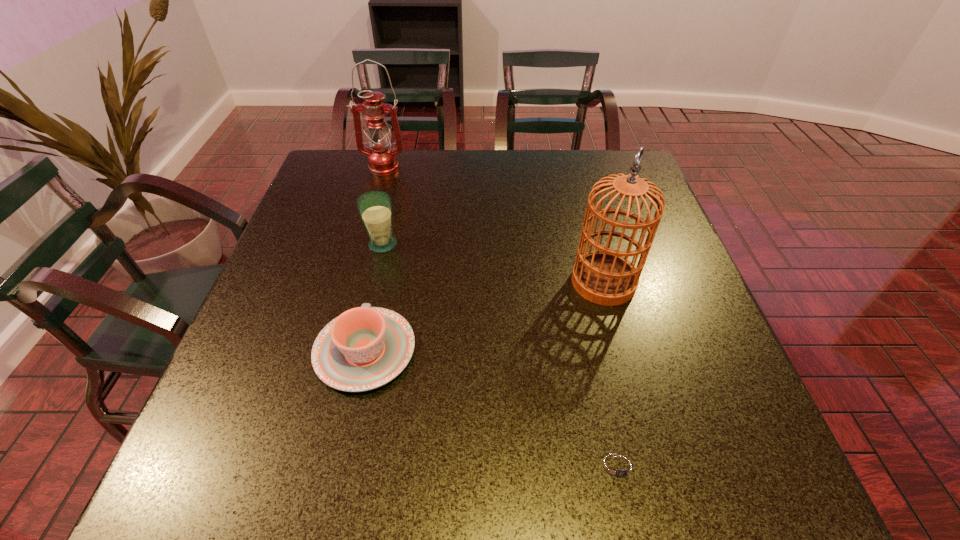
At what (x,y) coordinates should I click in order to perform the action: click on vacant space located 0.360m on the right of the glass. Please return your answer as a coordinate pair (x, y). Looking at the image, I should click on coord(543,245).

Identify the location of vacant space located 0.070m on the handle side of the second shortest object. (379, 288).

The height and width of the screenshot is (540, 960). Identify the location of vacant space located 0.290m on the handle side of the second shortest object. (393, 226).

The width and height of the screenshot is (960, 540). What are the coordinates of `blank space located 0.260m on the handle side of the second shortest object` in the screenshot? It's located at (391, 234).

This screenshot has width=960, height=540. I want to click on object positioned at the far edge, so click(382, 159).

At what (x,y) coordinates should I click in order to perform the action: click on object located at the near edge. Please return your answer as a coordinate pair (x, y). The width and height of the screenshot is (960, 540). Looking at the image, I should click on (619, 467).

Identify the location of oil lamp at the left edge. Image resolution: width=960 pixels, height=540 pixels. (382, 159).

At what (x,y) coordinates should I click in order to perform the action: click on chinaware present at the left edge. Please return your answer as a coordinate pair (x, y). Image resolution: width=960 pixels, height=540 pixels. Looking at the image, I should click on (366, 347).

The image size is (960, 540). Identify the location of object that is positioned at the right edge. (606, 277).

Locate an element on the screen. object located at the far left corner is located at coordinates (382, 159).